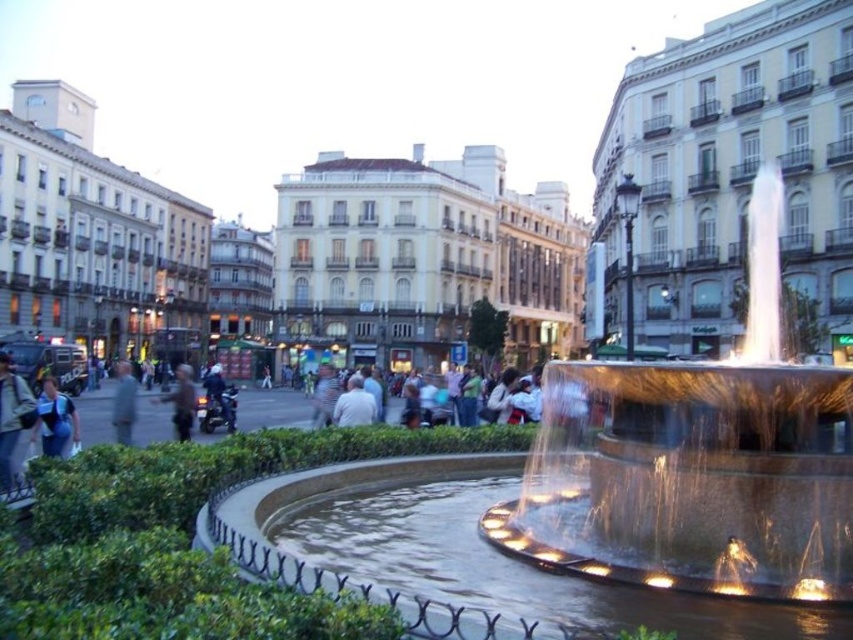
Can you confirm if light gray shirt at center is bigger than dark brown leather jacket at center?

No, light gray shirt at center is not bigger than dark brown leather jacket at center.

Is point (352, 406) farther from viewer compared to point (169, 401)?

No.

I want to click on light gray shirt at center, so click(354, 404).

Locate an element on the screen. Image resolution: width=853 pixels, height=640 pixels. illuminated stone fountain at center is located at coordinates (695, 461).

Which is more to the right, illuminated stone fountain at center or dark gray shirt at left?

Positioned to the right is illuminated stone fountain at center.

Does point (753, 595) come closer to viewer compared to point (132, 412)?

Yes.

This screenshot has height=640, width=853. I want to click on illuminated stone fountain at center, so click(695, 461).